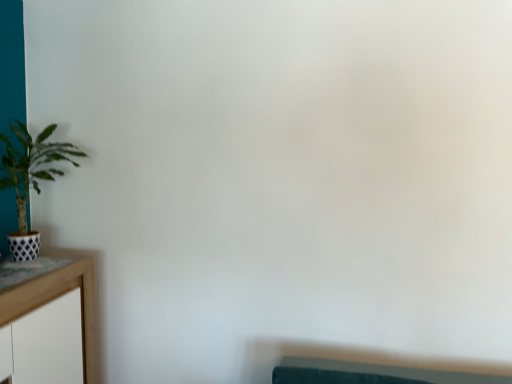
Question: From the image's perspective, is green matte plant at left positioned above or below wooden table at left?

Choices:
 (A) above
 (B) below

Answer: (A)

Question: In terms of height, does green matte plant at left look taller or shorter compared to wooden table at left?

Choices:
 (A) tall
 (B) short

Answer: (B)

Question: Is point (26, 200) positioned closer to the camera than point (95, 326)?

Choices:
 (A) closer
 (B) farther

Answer: (A)

Question: From the image's perspective, is wooden table at left located above or below green matte plant at left?

Choices:
 (A) above
 (B) below

Answer: (B)

Question: Choose the correct answer: Is wooden table at left inside green matte plant at left or outside it?

Choices:
 (A) outside
 (B) inside

Answer: (A)

Question: Is point (58, 249) closer or farther from the camera than point (0, 139)?

Choices:
 (A) farther
 (B) closer

Answer: (A)

Question: Looking at the image, does wooden table at left seem bigger or smaller compared to green matte plant at left?

Choices:
 (A) big
 (B) small

Answer: (A)